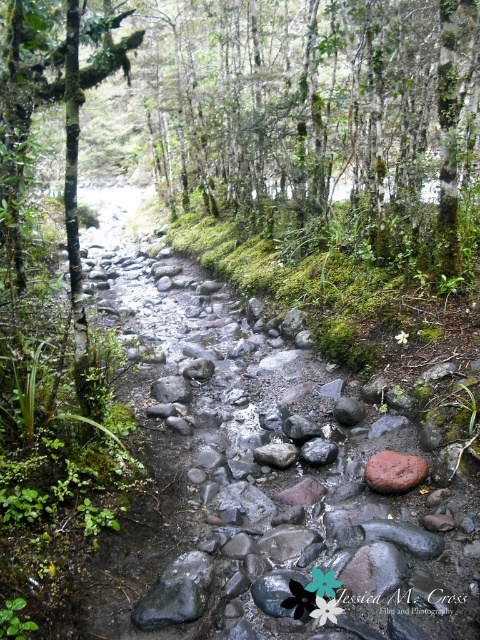
In the scene shown: Is gray smooth rock at center smaller than smooth gray rock at center?

Actually, gray smooth rock at center might be larger than smooth gray rock at center.

Which is more to the left, gray smooth rock at center or smooth gray rock at center?

gray smooth rock at center

Between point (288, 458) and point (350, 396), which one is positioned behind?

The point (350, 396) is behind.

You are a GUI agent. You are given a task and a screenshot of the screen. Output one action in this format:
    pyautogui.click(x=<x>, y=<y>)
    Task: Click on the gray smooth rock at center
    This screenshot has height=640, width=480.
    Given the screenshot: What is the action you would take?
    pyautogui.click(x=276, y=454)

Is green mossy tree at upper center closer to the viewer compared to smooth gray rock at center?

No, green mossy tree at upper center is behind smooth gray rock at center.

Who is positioned more to the left, green mossy tree at upper center or smooth gray rock at center?

From the viewer's perspective, green mossy tree at upper center appears more on the left side.

Who is more distant from viewer, (320, 100) or (345, 397)?

Point (320, 100)

Where is `green mossy tree at upper center`? This screenshot has width=480, height=640. green mossy tree at upper center is located at coordinates (x=320, y=113).

Is green mossy tree at upper center positioned at the back of gray smooth rock at center?

Yes, it is behind gray smooth rock at center.

Is green mossy tree at upper center positioned before gray smooth rock at center?

No, green mossy tree at upper center is behind gray smooth rock at center.

You are a GUI agent. You are given a task and a screenshot of the screen. Output one action in this format:
    pyautogui.click(x=<x>, y=<y>)
    Task: Click on the green mossy tree at upper center
    This screenshot has width=480, height=640.
    Given the screenshot: What is the action you would take?
    (320, 113)